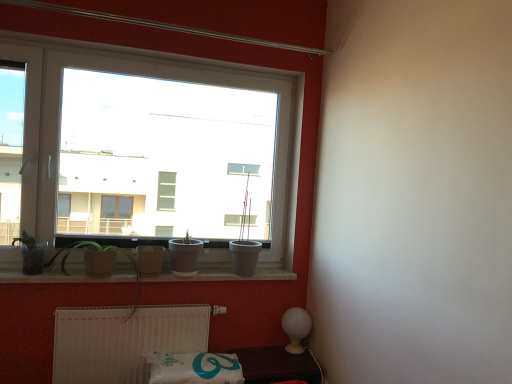
In order to click on free space above white concrete window sill at lower center (from a real-world perspective) in this screenshot , I will do (x=151, y=274).